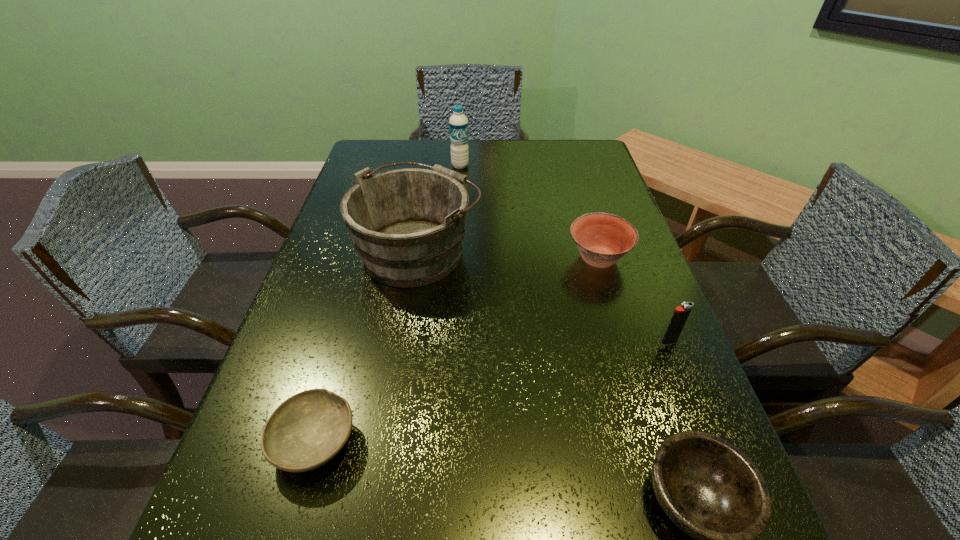
Find the location of a particular element. The image size is (960, 540). blank area located on the back of the fourth farthest object is located at coordinates (633, 249).

I want to click on vacant area situated on the left of the third shortest object, so coord(520,259).

This screenshot has height=540, width=960. I want to click on free space located on the front of the shortest bowl, so click(288, 536).

Find the location of a particular element. object at the far edge is located at coordinates (458, 123).

Locate an element on the screen. Image resolution: width=960 pixels, height=540 pixels. wine bucket that is positioned at the left edge is located at coordinates (407, 225).

You are a GUI agent. You are given a task and a screenshot of the screen. Output one action in this format:
    pyautogui.click(x=<x>, y=<y>)
    Task: Click on the bowl that is at the left edge
    The image size is (960, 540).
    Given the screenshot: What is the action you would take?
    pyautogui.click(x=306, y=431)

The width and height of the screenshot is (960, 540). What are the coordinates of `igniter that is positioned at the right edge` in the screenshot? It's located at (681, 313).

What are the coordinates of `bowl situated at the right edge` in the screenshot? It's located at (602, 239).

The image size is (960, 540). I want to click on vacant space at the far edge, so click(429, 166).

In the image, there is a desktop. Where is `vacant space at the left edge`? This screenshot has width=960, height=540. vacant space at the left edge is located at coordinates (304, 512).